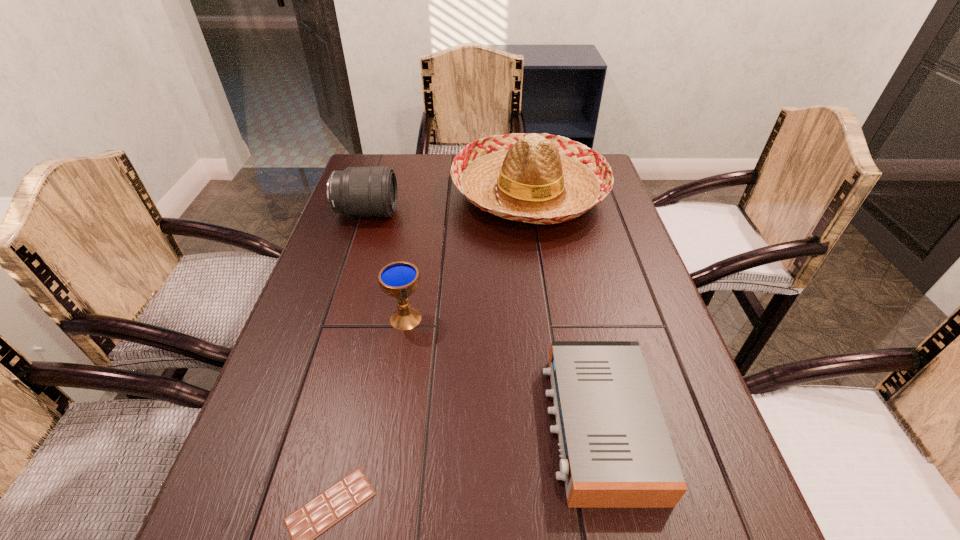
At what (x,y) coordinates should I click in order to perform the action: click on the tallest object. Please return your answer as a coordinate pair (x, y). This screenshot has height=540, width=960. Looking at the image, I should click on (534, 178).

The width and height of the screenshot is (960, 540). What are the coordinates of `telephoto lens` in the screenshot? It's located at 357,191.

This screenshot has width=960, height=540. Find the location of `the third nearest object`. the third nearest object is located at coordinates (399, 280).

Image resolution: width=960 pixels, height=540 pixels. Find the location of `radio receiver`. radio receiver is located at coordinates (616, 452).

Identify the location of vacant space located 0.170m on the front of the sombrero. This screenshot has width=960, height=540. (542, 285).

At what (x,y) coordinates should I click in order to perform the action: click on vacant space situated 0.250m on the surface of the telephoto lens. Please return your answer as a coordinate pair (x, y). The height and width of the screenshot is (540, 960). Looking at the image, I should click on (482, 213).

The height and width of the screenshot is (540, 960). In order to click on vacant space located 0.100m on the back of the chalice in this screenshot , I will do `click(413, 275)`.

Where is `vacant space located 0.230m on the control panel of the radio receiver`? vacant space located 0.230m on the control panel of the radio receiver is located at coordinates (422, 426).

At what (x,y) coordinates should I click in order to perform the action: click on free point located on the control panel of the radio receiver. Please return your answer as a coordinate pair (x, y). Looking at the image, I should click on (368, 426).

This screenshot has height=540, width=960. I want to click on blank space located 0.180m on the control panel of the radio receiver, so pyautogui.click(x=450, y=426).